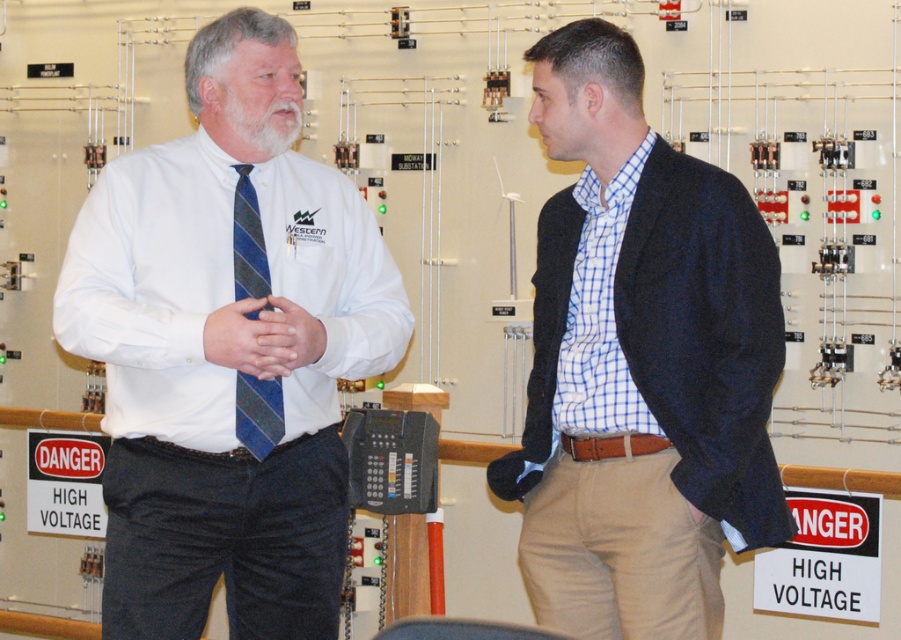
You are standing in the electrical control room and need to locate the person wearing the blue checkered shirt at center. According to the coordinates provided, where exactly should you look to find them?

The blue checkered shirt at center is located at coordinates point (640, 364).

You are an electrician entering the control room and see the white shirt at center and the blue striped tie at center. Which one is closer to you?

The white shirt at center is closer to you since it is in front of the blue striped tie at center.

You are an inspector in the control room and need to verify the position of the blue striped tie at center and whitehairbeard at left. From your perspective, which object is located to the left?

The blue striped tie at center is positioned on the left side of whitehairbeard at left, so the blue striped tie at center is on the left.